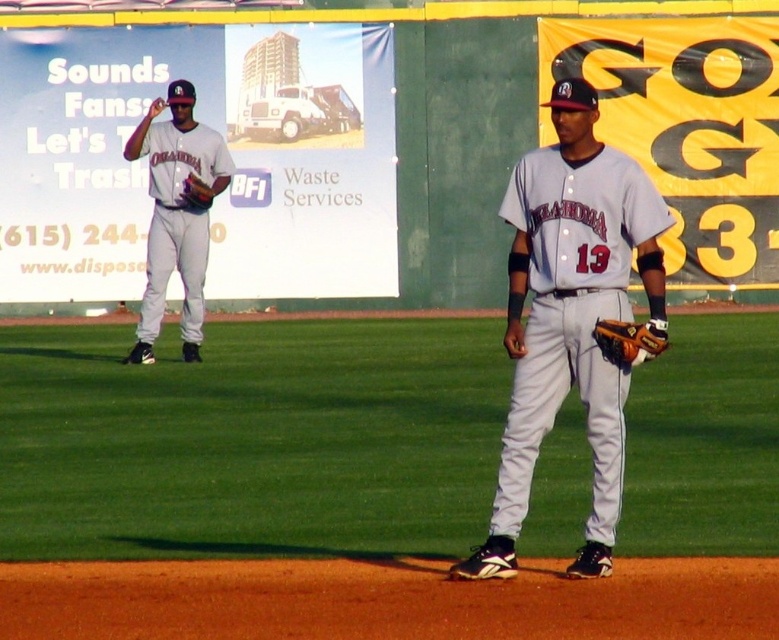
You are a photographer standing at the center of the field. You want to take a photo of the white uniform pants at center. Which direction should you move to get a better shot?

The white uniform pants at center are located at point (251, 440). Since you are at the center, moving towards the direction of the point would be necessary for a better shot.

You are a photographer at the baseball game and want to take a photo of both the white uniform pants at center and the gray fabric baseball uniform at center. Which one should you focus on first if you want to capture them in the order they appear from left to right?

The white uniform pants at center are to the left of the gray fabric baseball uniform at center, so you should focus on the white uniform pants at center first to capture them from left to right.